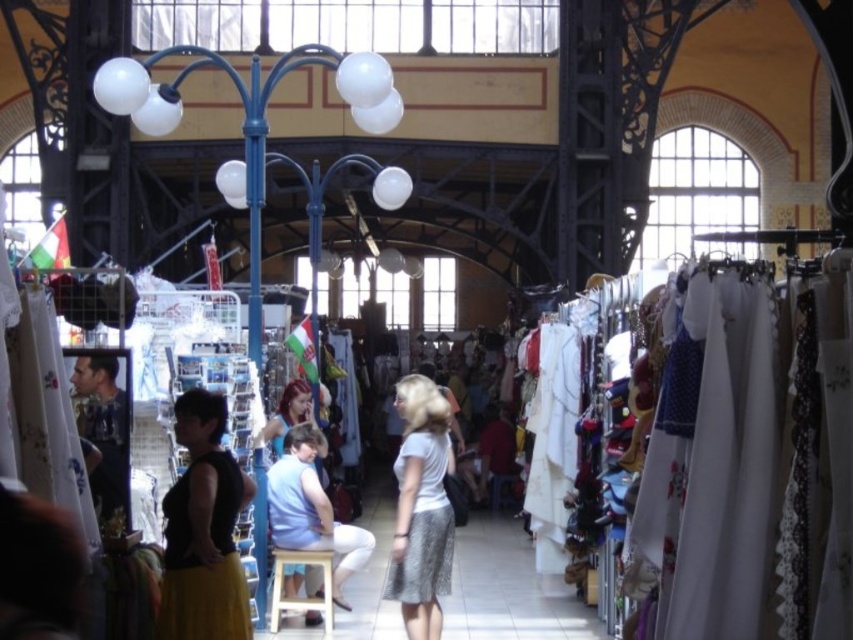
You are standing in the market and want to take a photo of the point at coordinates point (332, 582). If your camera has a maximum focus range of 200 feet, will it be able to focus on that point?

The distance of point (332, 582) from viewer is 199.22 feet, which is within the camera maximum focus range of 200 feet. So yes, the camera can focus on that point.

You are a customer in the market looking to purchase a light blue fabric at center and a light brown wooden stool at center. You want to know which item is taller. Could you determine this based on the scene?

The light blue fabric at center is much taller than the light brown wooden stool at center according to the scene description.

You are a customer in the market and want to buy a white lace skirt at center. The nearest stall is 57.38 meters away from you. Can you walk to the stall to purchase it?

The nearest stall to the white lace skirt at center is 57.38 meters away, so you can walk to the stall to purchase it.